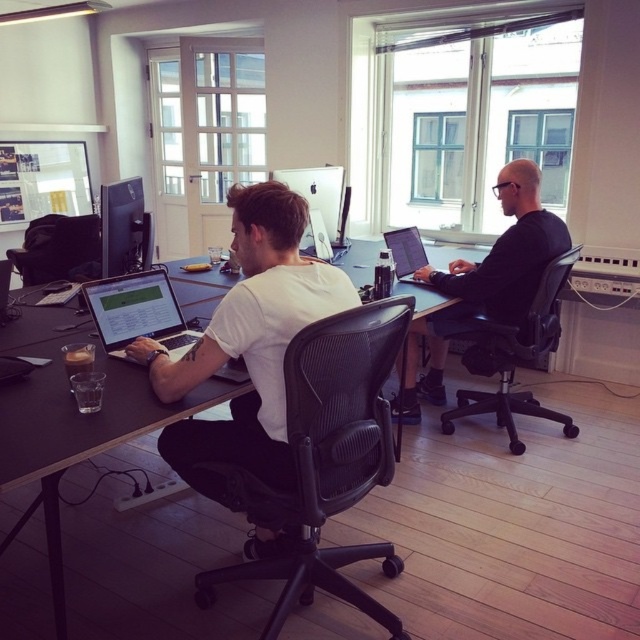
Question: Which object appears farthest from the camera in this image?

Choices:
 (A) matte black monitor at upper left
 (B) black plastic desk at center

Answer: (A)

Question: Does black mesh swivel chair at center appear on the left side of black matte shirt at center?

Choices:
 (A) yes
 (B) no

Answer: (A)

Question: Which is farther from the matte black laptop at center?

Choices:
 (A) black matte shirt at center
 (B) white matte shirt at center
 (C) matte black monitor at upper left
 (D) matte white monitor at center

Answer: (B)

Question: Is black mesh swivel chair at right smaller than matte black monitor at upper left?

Choices:
 (A) no
 (B) yes

Answer: (A)

Question: Which point appears farthest from the camera in this image?

Choices:
 (A) (208, 364)
 (B) (116, 262)
 (C) (156, 328)
 (D) (417, 227)

Answer: (D)

Question: Can you confirm if black mesh swivel chair at center is wider than matte black laptop at left?

Choices:
 (A) no
 (B) yes

Answer: (B)